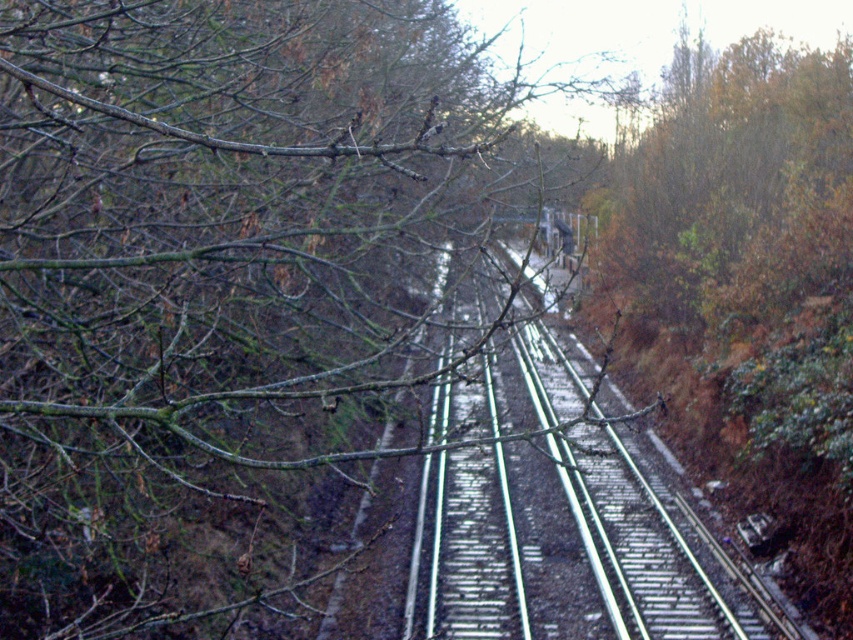
Who is higher up, green matte branches at upper left or metallic silver track at center?

Positioned higher is green matte branches at upper left.

This screenshot has width=853, height=640. What are the coordinates of `green matte branches at upper left` in the screenshot? It's located at (213, 285).